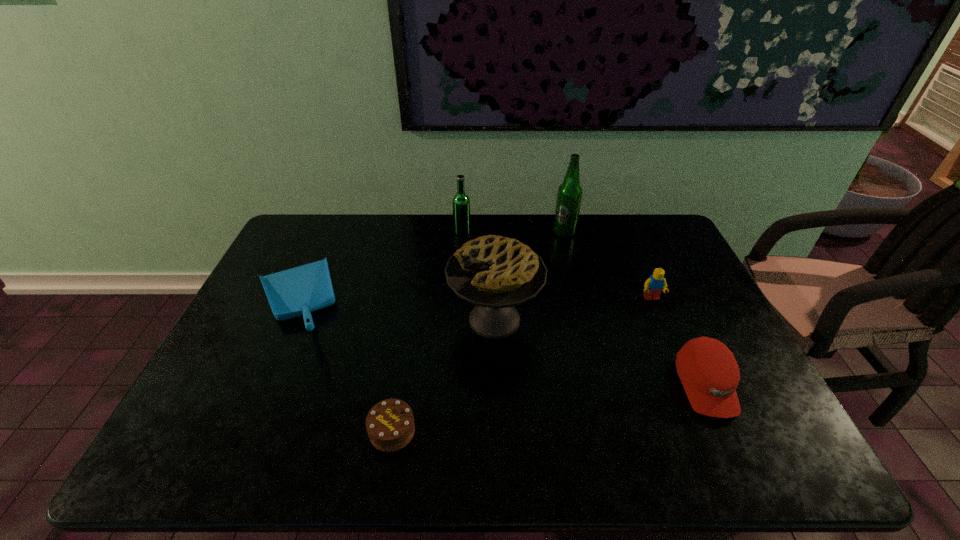
This screenshot has height=540, width=960. Identify the location of free space between the chocolate cake and the shorter beer bottle. (427, 332).

You are a GUI agent. You are given a task and a screenshot of the screen. Output one action in this format:
    pyautogui.click(x=<x>, y=<y>)
    Task: Click on the vacant space that is in between the pie and the chocolate cake
    The height and width of the screenshot is (540, 960).
    Given the screenshot: What is the action you would take?
    pyautogui.click(x=444, y=375)

Identify the location of vacant space that's between the cap and the taller beer bottle. The width and height of the screenshot is (960, 540). (635, 309).

I want to click on free area in between the Lego and the left beer bottle, so click(x=557, y=266).

You are a GUI agent. You are given a task and a screenshot of the screen. Output one action in this format:
    pyautogui.click(x=<x>, y=<y>)
    Task: Click on the free area in between the chocolate cake and the pie
    The height and width of the screenshot is (540, 960).
    Given the screenshot: What is the action you would take?
    pyautogui.click(x=444, y=375)

Identify which object is the third closest to the dustpan. Please provide its 2D coordinates. Your answer should be formatted as a tuple, i.e. [(x, y)], where the tuple contains the x and y coordinates of a point satisfying the conditions above.

[(461, 203)]

Identify the location of object that stands as the fourth closest to the second object from left to right. (461, 203).

Locate an element on the screen. The width and height of the screenshot is (960, 540). free location that satisfies the following two spatial constraints: 1. on the back side of the left beer bottle; 2. on the right side of the dustpan is located at coordinates (x=326, y=233).

The height and width of the screenshot is (540, 960). I want to click on free location that satisfies the following two spatial constraints: 1. on the cut side of the pie; 2. on the front side of the shortest object, so click(x=498, y=431).